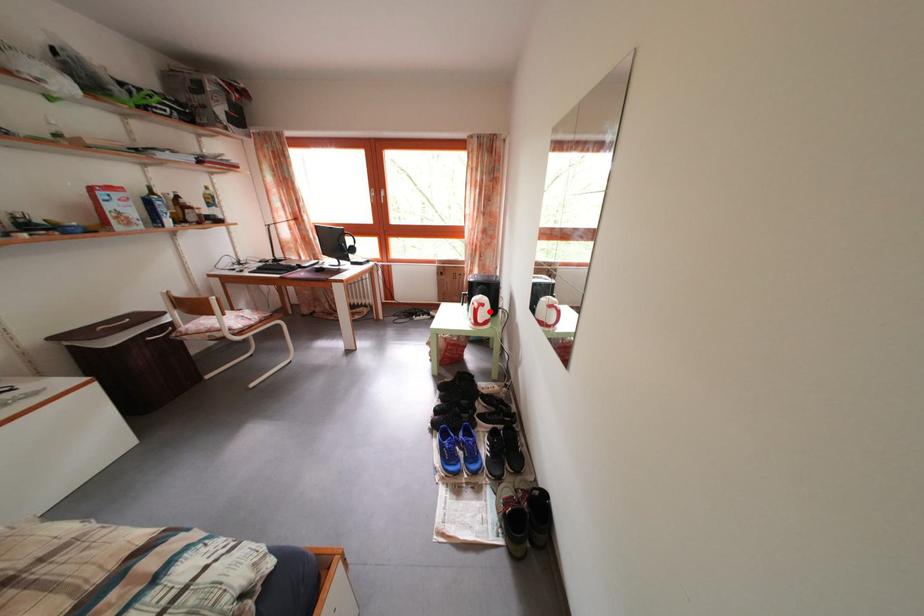
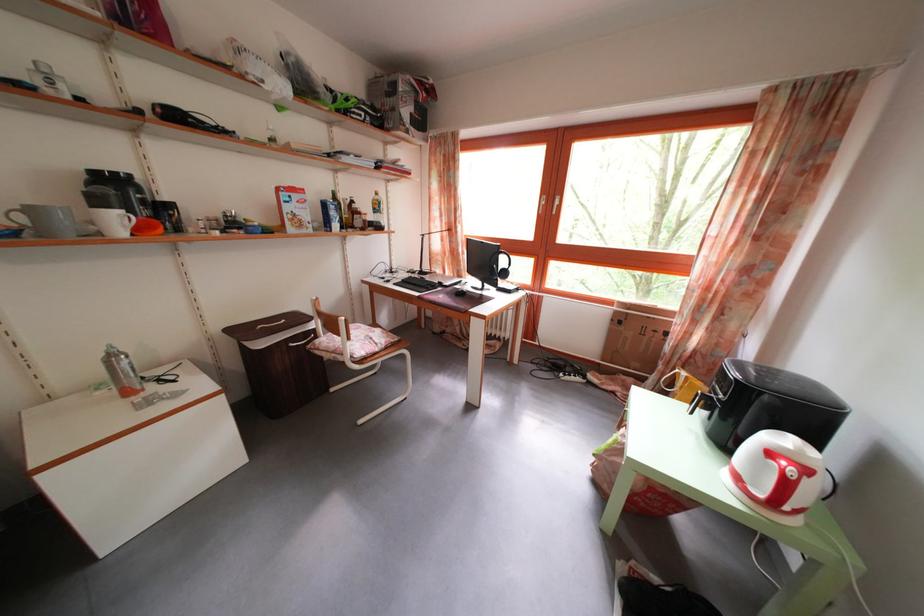
Question: I am providing you with two images of the same scene from different viewpoints. Given a red point in image1, look at the same physical point in image2. Is it:

Choices:
 (A) Closer to the viewpoint
 (B) Farther from the viewpoint

Answer: (A)